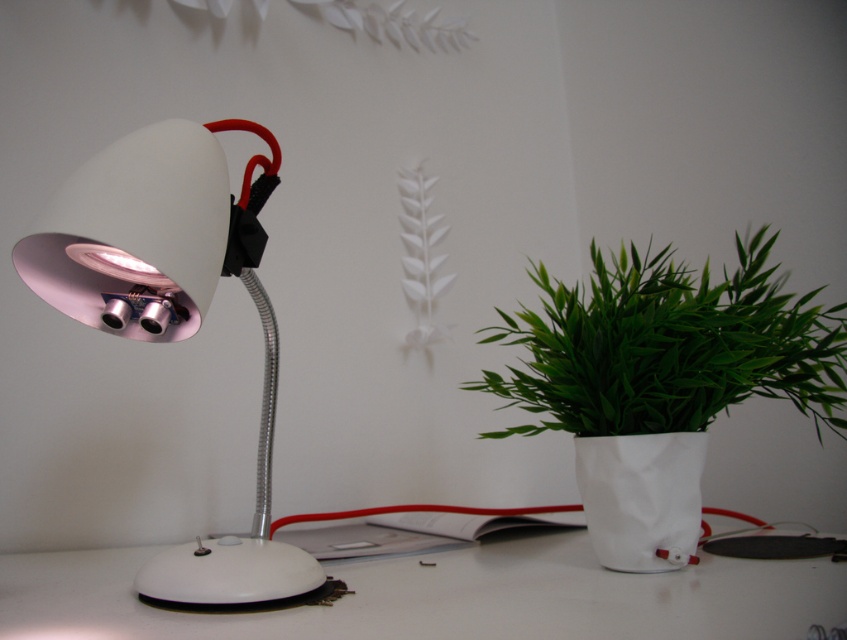
Is the position of white glossy table at center more distant than that of white glossy desk lamp at left?

Yes, it is behind white glossy desk lamp at left.

How distant is white glossy table at center from white glossy desk lamp at left?

A distance of 8.35 inches exists between white glossy table at center and white glossy desk lamp at left.

Is point (336, 632) less distant than point (20, 269)?

Yes, point (336, 632) is closer to viewer.

The width and height of the screenshot is (847, 640). In order to click on white glossy table at center in this screenshot , I will do `click(446, 596)`.

Which is more to the left, white glossy table at center or green leafy plant at right?

From the viewer's perspective, white glossy table at center appears more on the left side.

Who is lower down, white glossy table at center or green leafy plant at right?

white glossy table at center is lower down.

Is point (245, 614) positioned after point (522, 316)?

That is False.

I want to click on white glossy table at center, so click(x=446, y=596).

Does white glossy desk lamp at left have a lesser width compared to green leafy plant at right?

Yes.

The height and width of the screenshot is (640, 847). I want to click on white glossy desk lamp at left, so click(173, 308).

This screenshot has height=640, width=847. I want to click on white glossy desk lamp at left, so click(x=173, y=308).